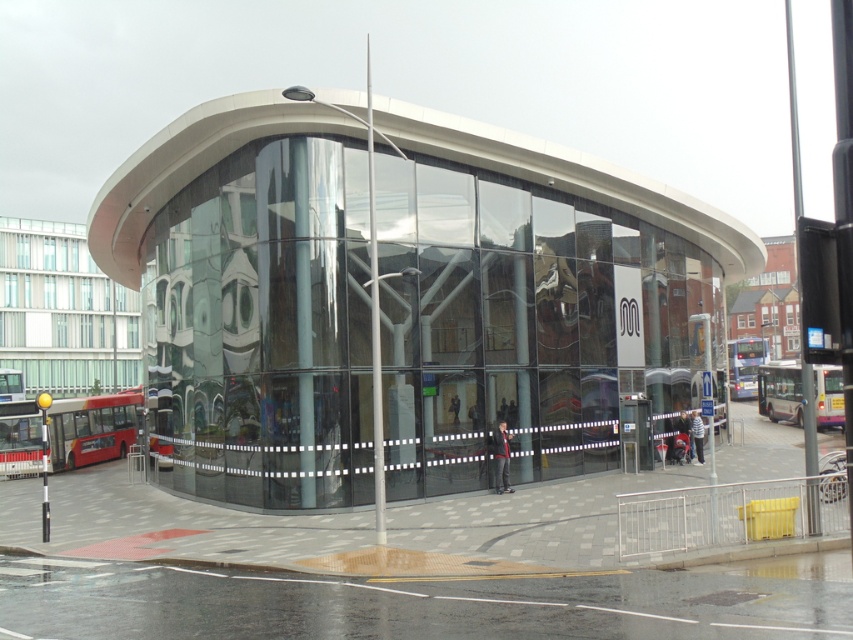
Question: Based on their relative distances, which object is nearer to the white metallic bus at right?

Choices:
 (A) blue metallic bus at center
 (B) transparent glass bus station at center
 (C) red metallic bus at lower left

Answer: (B)

Question: Estimate the real-world distances between objects in this image. Which object is farther from the blue metallic bus at center?

Choices:
 (A) red metallic bus at lower left
 (B) white metallic bus at right

Answer: (A)

Question: Is transparent glass bus station at center to the right of blue metallic bus at center from the viewer's perspective?

Choices:
 (A) yes
 (B) no

Answer: (B)

Question: Is transparent glass bus station at center below white metallic bus at right?

Choices:
 (A) no
 (B) yes

Answer: (A)

Question: Is red metallic bus at lower left smaller than blue metallic bus at center?

Choices:
 (A) yes
 (B) no

Answer: (A)

Question: Based on their relative distances, which object is nearer to the white metallic bus at right?

Choices:
 (A) blue metallic bus at center
 (B) red metallic bus at lower left
 (C) transparent glass bus station at center

Answer: (C)